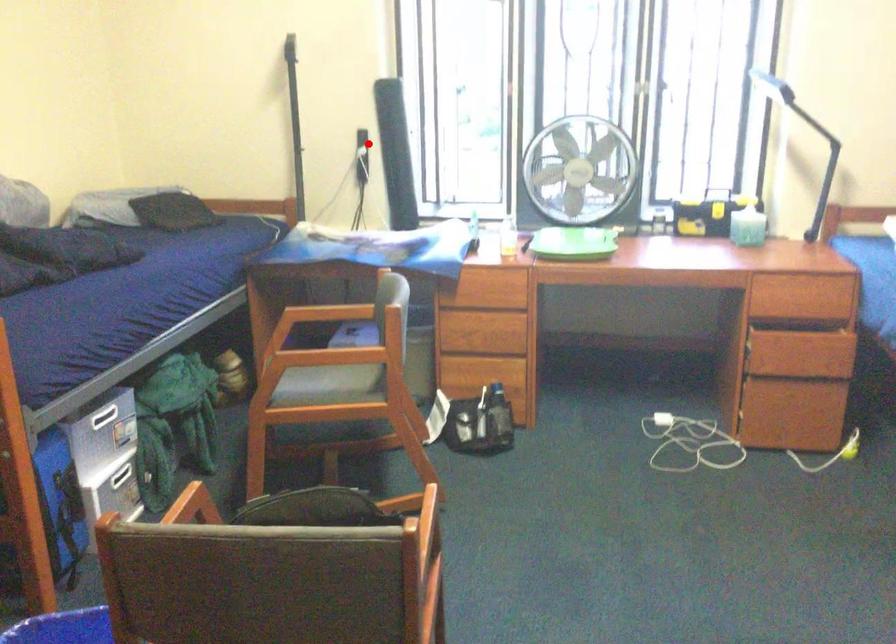
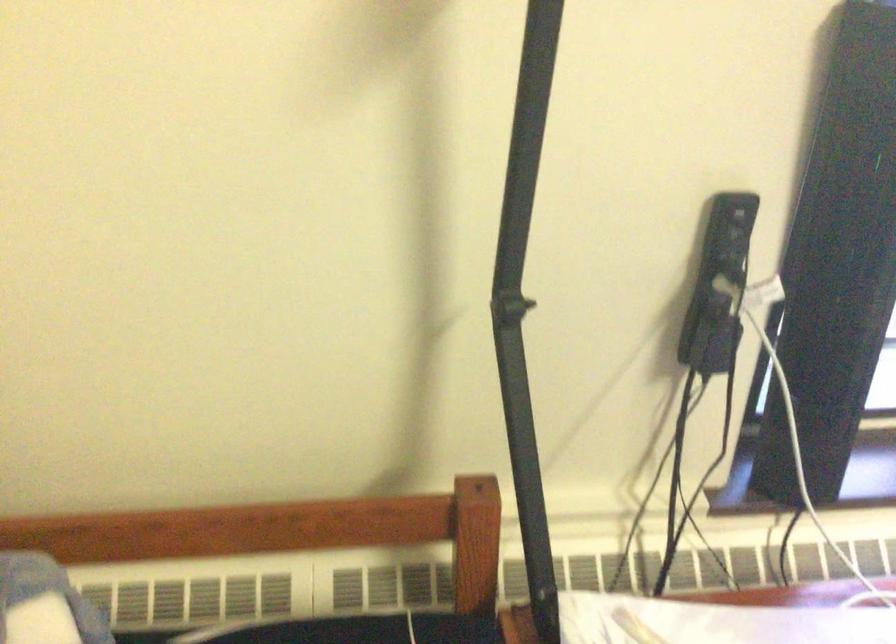
Question: A red point is marked in image1. In image2, is the corresponding 3D point closer to the camera or farther? Reply with the corresponding letter.

Choices:
 (A) The corresponding 3D point is closer.
 (B) The corresponding 3D point is farther.

Answer: (A)